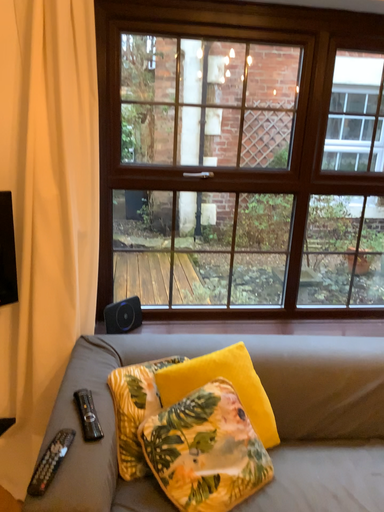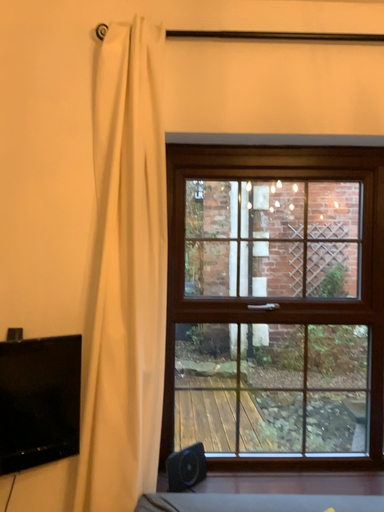
Question: How did the camera likely rotate when shooting the video?

Choices:
 (A) rotated downward
 (B) rotated upward

Answer: (B)